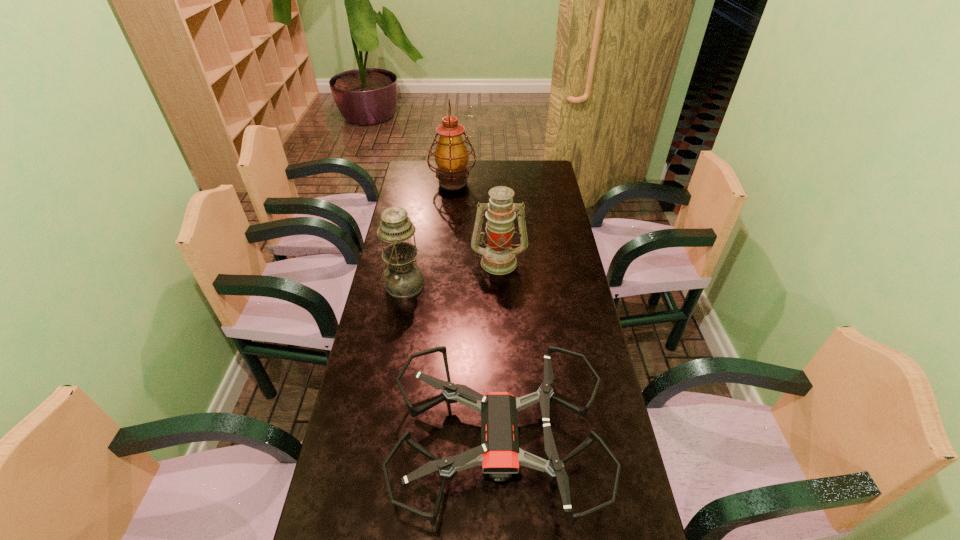
Locate an element on the screen. This screenshot has width=960, height=540. the tallest object is located at coordinates (451, 156).

This screenshot has height=540, width=960. Identify the location of the farthest object. (451, 156).

Identify the location of the shortest object. (499, 454).

Identify the location of drone. (499, 454).

Locate an element on the screen. vacant space located 0.090m on the front of the tallest oil lamp is located at coordinates (451, 206).

Identify the location of free space located with the camera facing forward on the drone. (349, 441).

In order to click on vacant space situated 0.100m with the camera facing forward on the drone in this screenshot , I will do `click(357, 441)`.

Find the location of a particular element. object located in the far edge section of the desktop is located at coordinates (451, 156).

Locate an element on the screen. drone that is positioned at the left edge is located at coordinates (499, 454).

Where is `object located in the right edge section of the desktop`? This screenshot has width=960, height=540. object located in the right edge section of the desktop is located at coordinates (499, 454).